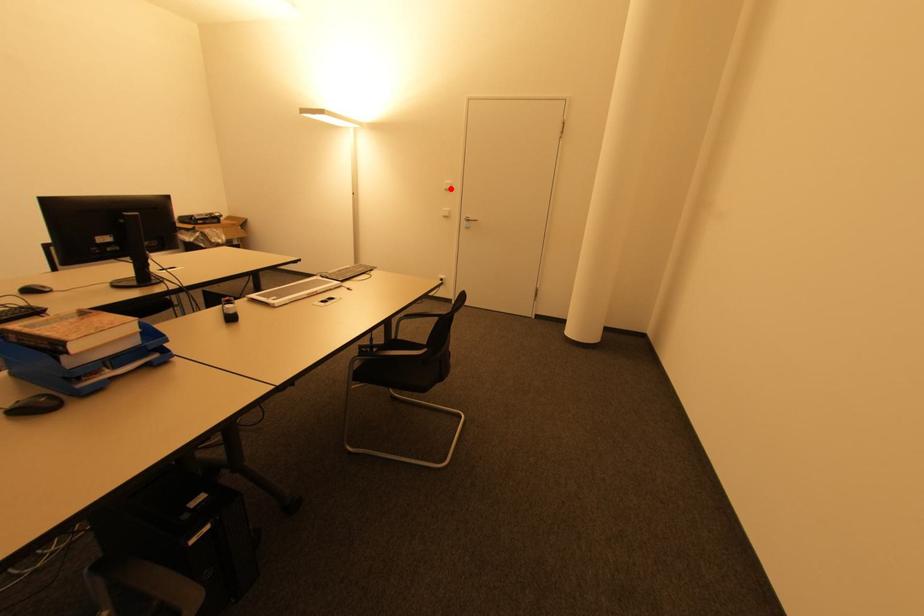
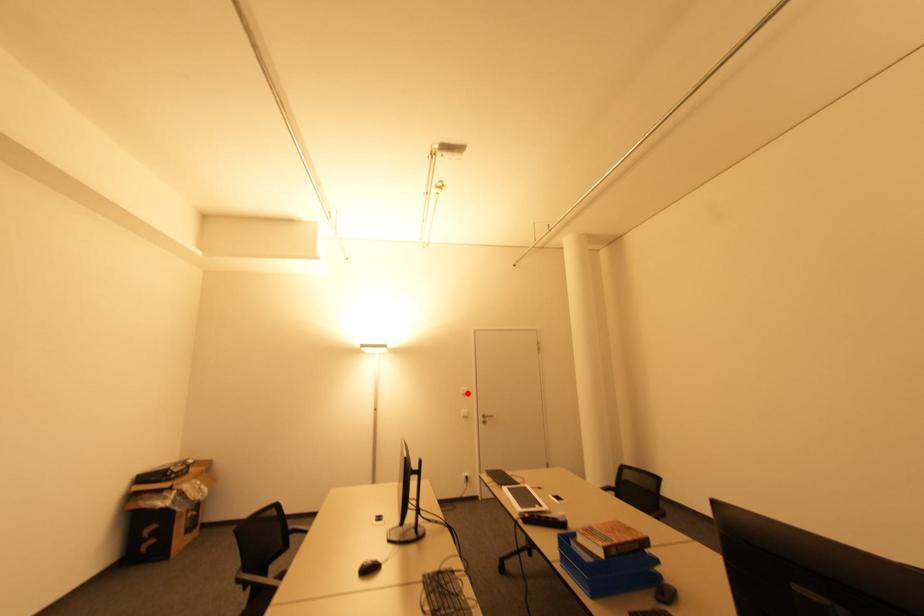
I am providing you with two images of the same scene from different viewpoints. A red point is marked on the first image and another point is marked on the second image. Is the red point in image1 aligned with the point shown in image2?

Yes